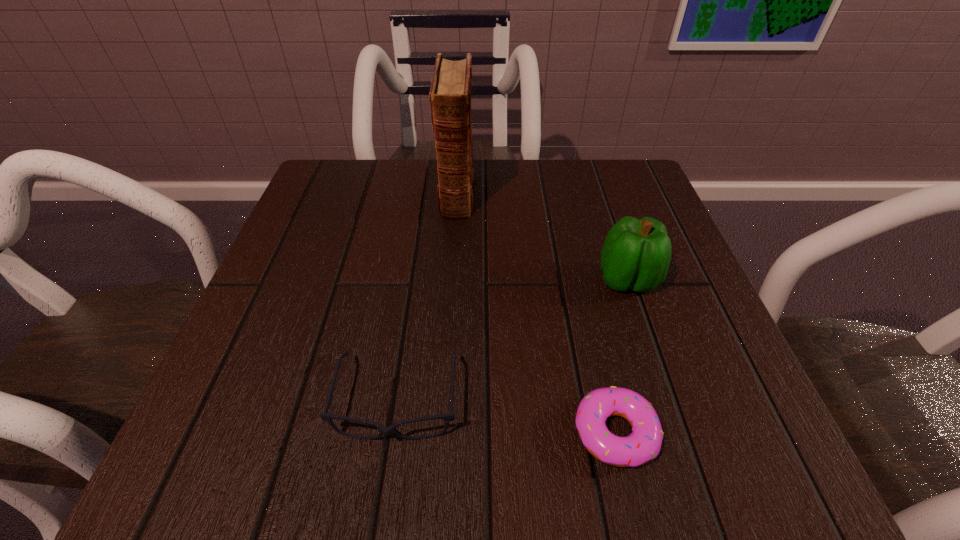
Locate an element on the screen. The image size is (960, 540). free space between the third tallest object and the tallest object is located at coordinates coord(427,296).

The width and height of the screenshot is (960, 540). Identify the location of free area in between the tallest object and the third tallest object. (427, 296).

Identify which object is the nearest to the shortest object. Please provide its 2D coordinates. Your answer should be formatted as a tuple, i.e. [(x, y)], where the tuple contains the x and y coordinates of a point satisfying the conditions above.

[(450, 416)]

Point out which object is positioned as the third nearest to the shortest object. Please provide its 2D coordinates. Your answer should be formatted as a tuple, i.e. [(x, y)], where the tuple contains the x and y coordinates of a point satisfying the conditions above.

[(450, 92)]

Find the location of a particular element. vacant position in the image that satisfies the following two spatial constraints: 1. on the spine side of the tallest object; 2. on the right side of the doughnut is located at coordinates click(x=442, y=432).

Identify the location of vacant space that satisfies the following two spatial constraints: 1. on the spine side of the farthest object; 2. on the left side of the shortest object. click(442, 432).

The width and height of the screenshot is (960, 540). In order to click on free space that satisfies the following two spatial constraints: 1. on the spine side of the third nearest object; 2. on the right side of the tallest object in this screenshot , I will do `click(451, 280)`.

At what (x,y) coordinates should I click in order to perform the action: click on vacant area that satisfies the following two spatial constraints: 1. on the spine side of the hardback book; 2. on the right side of the second farthest object. Please return your answer as a coordinate pair (x, y). Image resolution: width=960 pixels, height=540 pixels. Looking at the image, I should click on (451, 280).

This screenshot has height=540, width=960. Find the location of `free location that satisfies the following two spatial constraints: 1. on the spine side of the third nearest object; 2. on the left side of the tallest object`. free location that satisfies the following two spatial constraints: 1. on the spine side of the third nearest object; 2. on the left side of the tallest object is located at coordinates coord(451,280).